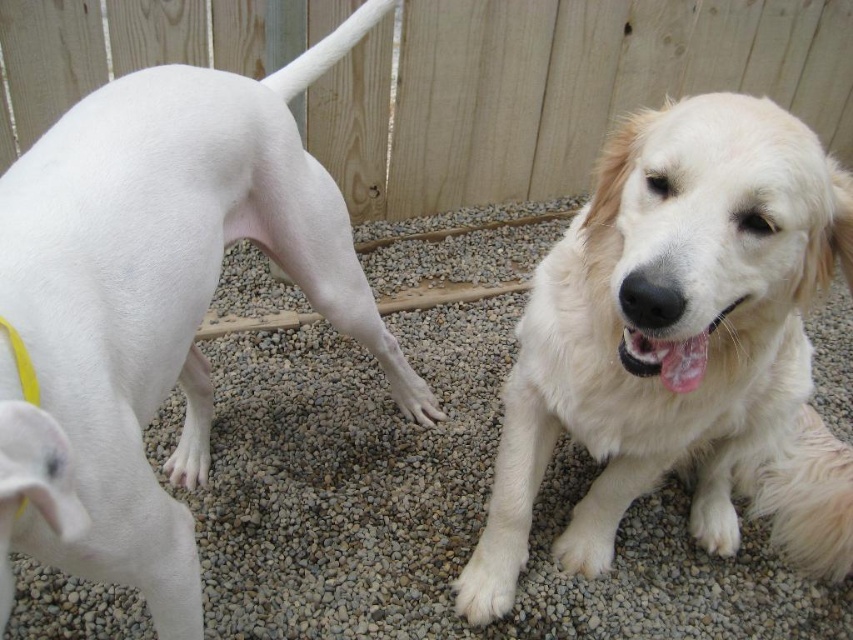
Question: Is white smooth dog at left positioned in front of white fur at lower left?

Choices:
 (A) no
 (B) yes

Answer: (B)

Question: Which point is closer to the camera?

Choices:
 (A) wooden fence at upper center
 (B) white fur at lower left
 (C) white fur paw at lower center

Answer: (C)

Question: Which point is farther to the camera?

Choices:
 (A) (538, 376)
 (B) (171, 58)

Answer: (B)

Question: Which object is closer to the camera taking this photo?

Choices:
 (A) white fur paw at lower center
 (B) white smooth dog at left

Answer: (B)

Question: Is white smooth dog at left above wooden fence at upper center?

Choices:
 (A) no
 (B) yes

Answer: (A)

Question: Is wooden fence at upper center above white fur paw at lower center?

Choices:
 (A) yes
 (B) no

Answer: (A)